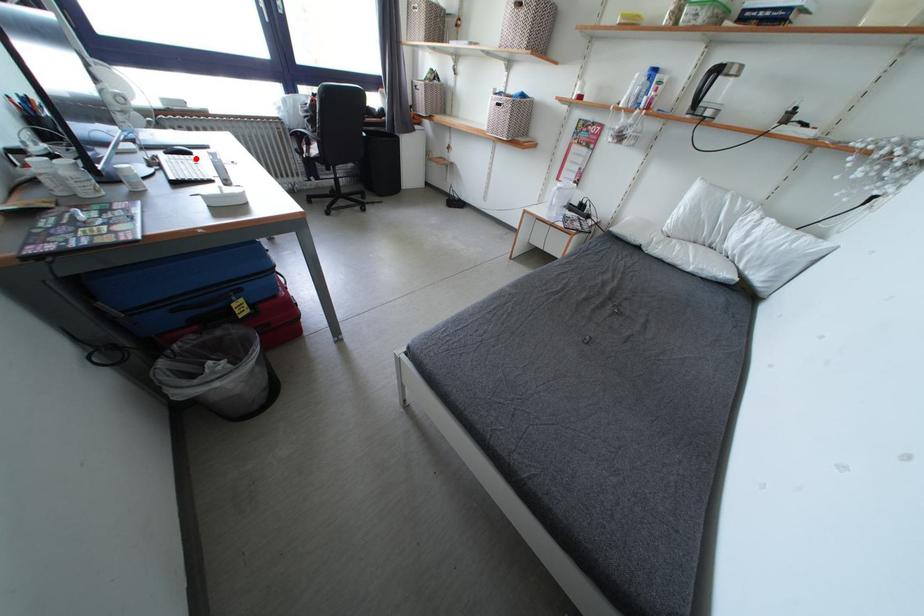
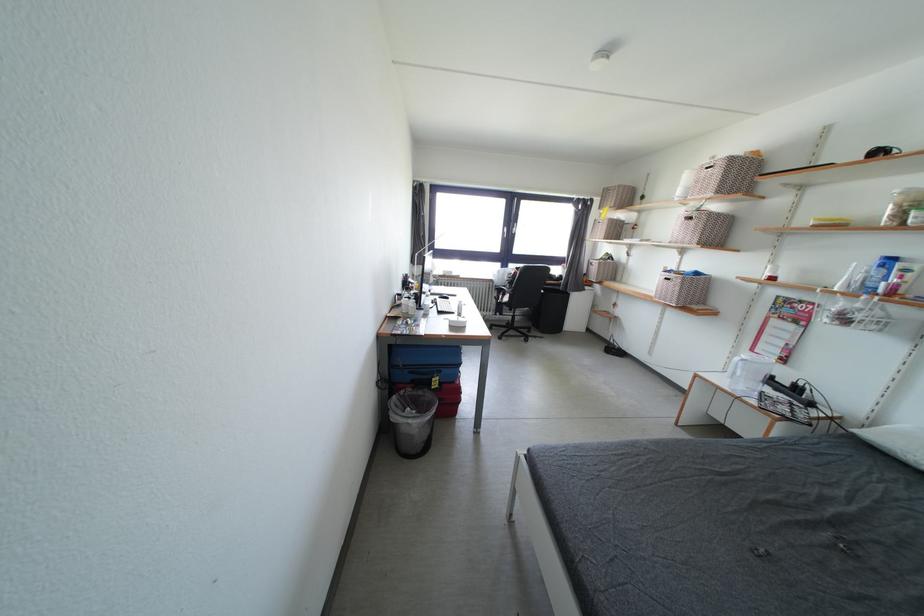
Find the pixel in the second image that matches the highlighted location in the first image.

(455, 302)